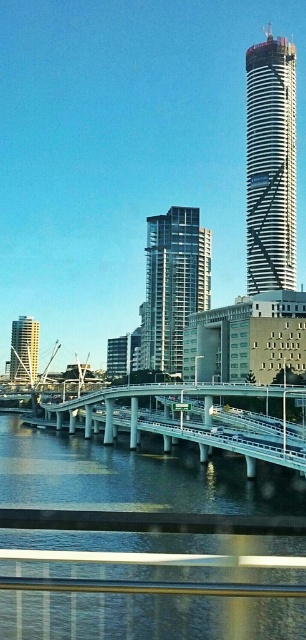
Which of these two, clear water at bridge lower or silver metallic tower at center, stands taller?

Standing taller between the two is silver metallic tower at center.

Who is more distant from viewer, (x=148, y=636) or (x=258, y=115)?

Point (x=258, y=115)

Find the location of a particular element. The width and height of the screenshot is (306, 640). clear water at bridge lower is located at coordinates (130, 477).

Is silver metallic tower at center bigger than glassy steel building at center?

Actually, silver metallic tower at center might be smaller than glassy steel building at center.

Identify the location of silver metallic tower at center. (271, 164).

Is clear water at bridge lower wider than white concrete bridge at center?

In fact, clear water at bridge lower might be narrower than white concrete bridge at center.

Does clear water at bridge lower have a lesser width compared to white concrete bridge at center?

Yes.

Measure the distance between clear water at bridge lower and camera.

clear water at bridge lower is 15.57 meters from camera.

At what (x,y) coordinates should I click in order to perform the action: click on clear water at bridge lower. Please return your answer as a coordinate pair (x, y). Looking at the image, I should click on 130,477.